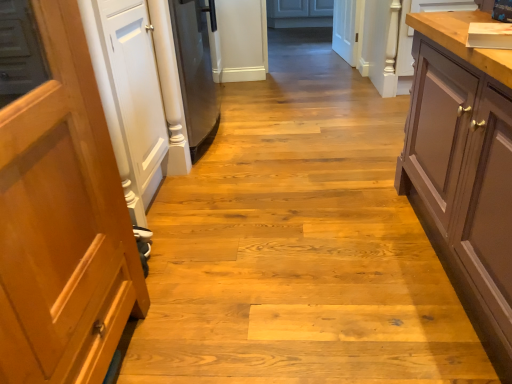
At what (x,y) coordinates should I click in order to perform the action: click on matte brown cabinet at right. Please return your answer as a coordinate pair (x, y). The height and width of the screenshot is (384, 512). Looking at the image, I should click on 464,169.

What do you see at coordinates (464, 169) in the screenshot?
I see `matte brown cabinet at right` at bounding box center [464, 169].

You are a GUI agent. You are given a task and a screenshot of the screen. Output one action in this format:
    pyautogui.click(x=<x>, y=<y>)
    Task: Click on the wooden countertop at upper right
    
    Given the screenshot: What is the action you would take?
    pyautogui.click(x=464, y=40)

The width and height of the screenshot is (512, 384). What do you see at coordinates (464, 40) in the screenshot?
I see `wooden countertop at upper right` at bounding box center [464, 40].

Identify the location of matte brown cabinet at right. This screenshot has width=512, height=384. (464, 169).

Which is more to the left, wooden countertop at upper right or matte brown cabinet at right?

matte brown cabinet at right is more to the left.

Which is behind, wooden countertop at upper right or matte brown cabinet at right?

wooden countertop at upper right is behind.

Which is less distant, (x=511, y=75) or (x=446, y=67)?

The point (x=511, y=75) is closer.

From the image's perspective, which one is positioned lower, wooden countertop at upper right or matte brown cabinet at right?

matte brown cabinet at right.

From a real-world perspective, is wooden countertop at upper right on top of matte brown cabinet at right?

No.

Between wooden countertop at upper right and matte brown cabinet at right, which one has smaller width?

wooden countertop at upper right.

Which of these two, wooden countertop at upper right or matte brown cabinet at right, stands taller?

With more height is matte brown cabinet at right.

Between wooden countertop at upper right and matte brown cabinet at right, which one has larger size?

With larger size is matte brown cabinet at right.

Do you think wooden countertop at upper right is within matte brown cabinet at right, or outside of it?

wooden countertop at upper right exists outside the volume of matte brown cabinet at right.

Is wooden countertop at upper right placed right next to matte brown cabinet at right?

They are not placed beside each other.

Is wooden countertop at upper right aimed at matte brown cabinet at right?

Yes, wooden countertop at upper right faces towards matte brown cabinet at right.

Can you tell me how much wooden countertop at upper right and matte brown cabinet at right differ in facing direction?

They differ by 179 degrees in their facing directions.

Locate an element on the screen. This screenshot has height=384, width=512. cabinetry on the left of wooden countertop at upper right is located at coordinates (464, 169).

Looking at this image, is matte brown cabinet at right to the left of wooden countertop at upper right from the viewer's perspective?

Indeed, matte brown cabinet at right is positioned on the left side of wooden countertop at upper right.

Considering the positions of objects matte brown cabinet at right and wooden countertop at upper right in the image provided, who is behind, matte brown cabinet at right or wooden countertop at upper right?

wooden countertop at upper right is further away from the camera.

Is point (457, 99) closer or farther from the camera than point (436, 19)?

Point (457, 99) appears to be closer to the viewer than point (436, 19).

From the image's perspective, is matte brown cabinet at right on wooden countertop at upper right?

No.

From a real-world perspective, is matte brown cabinet at right positioned under wooden countertop at upper right based on gravity?

No, from a real-world perspective, matte brown cabinet at right is not beneath wooden countertop at upper right.

In terms of width, does matte brown cabinet at right look wider or thinner when compared to wooden countertop at upper right?

In the image, matte brown cabinet at right appears to be wider than wooden countertop at upper right.

Which of these two, matte brown cabinet at right or wooden countertop at upper right, stands shorter?

wooden countertop at upper right is shorter.

Consider the image. Considering the sizes of objects matte brown cabinet at right and wooden countertop at upper right in the image provided, who is smaller, matte brown cabinet at right or wooden countertop at upper right?

Smaller between the two is wooden countertop at upper right.

Is matte brown cabinet at right situated inside wooden countertop at upper right or outside?

The correct answer is: outside.

Is matte brown cabinet at right placed right next to wooden countertop at upper right?

matte brown cabinet at right and wooden countertop at upper right are clearly separated.

Is matte brown cabinet at right oriented away from wooden countertop at upper right?

That's not correct — matte brown cabinet at right is not looking away from wooden countertop at upper right.

Measure the distance from matte brown cabinet at right to wooden countertop at upper right.

matte brown cabinet at right is 11.21 inches away from wooden countertop at upper right.

The width and height of the screenshot is (512, 384). I want to click on cabinetry in front of the wooden countertop at upper right, so click(464, 169).

In order to click on countertop on the right of matte brown cabinet at right in this screenshot , I will do `click(464, 40)`.

This screenshot has height=384, width=512. Find the location of `cabinetry on the left of wooden countertop at upper right`. cabinetry on the left of wooden countertop at upper right is located at coordinates (464, 169).